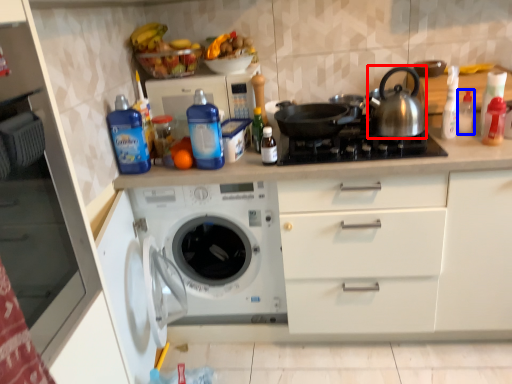
Question: Which point is further to the camera, tea pot (highlighted by a red box) or bottle (highlighted by a blue box)?

Choices:
 (A) tea pot
 (B) bottle

Answer: (B)